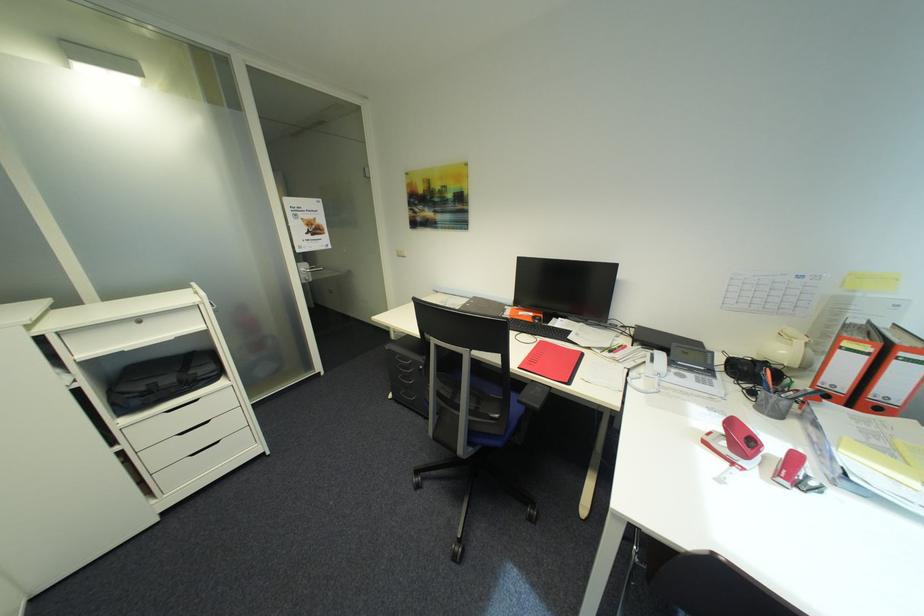
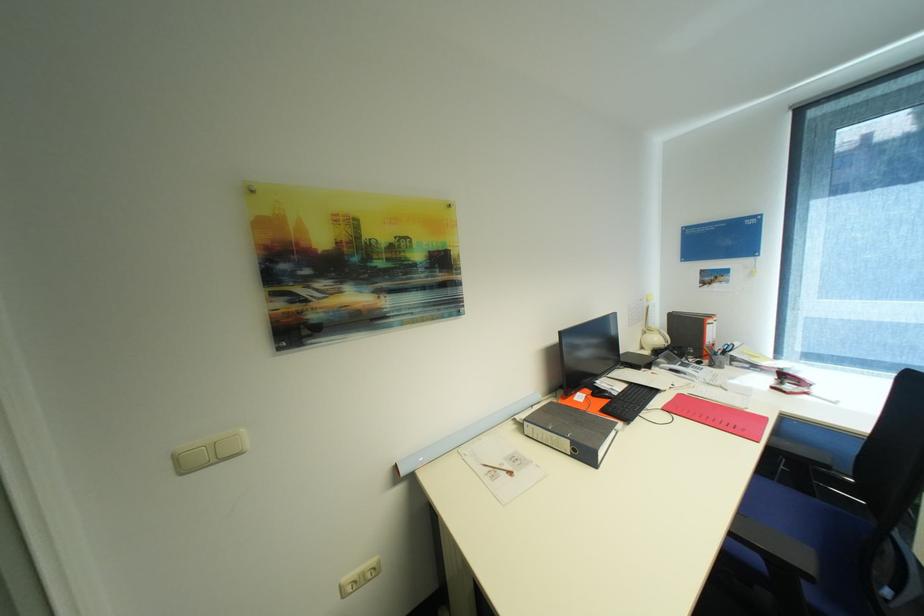
Where in the second image is the point corresponding to the point at 793,353 from the first image?

(663, 339)